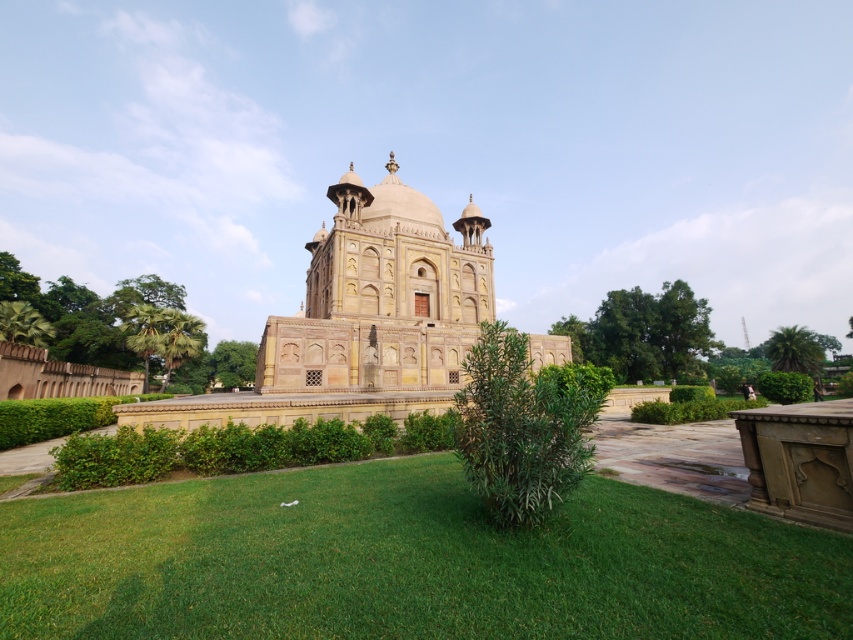
Between green grass at center and green leafy tree at left, which one has less height?

green grass at center

Can you confirm if green grass at center is shorter than green leafy tree at left?

Correct, green grass at center is not as tall as green leafy tree at left.

Who is more forward, (210, 557) or (55, 296)?

Positioned in front is point (210, 557).

Where is `green grass at center`? green grass at center is located at coordinates (408, 563).

Where is `green grass at center`? green grass at center is located at coordinates (408, 563).

Does green grass at center have a greater height compared to green leafy palm tree at lower right?

No, green grass at center is not taller than green leafy palm tree at lower right.

Who is more distant from viewer, [62,561] or [817,372]?

The point [817,372] is more distant.

Find the location of a particular element. This screenshot has width=853, height=640. green grass at center is located at coordinates (408, 563).

Is beige stone palace at center above green leafy tree at left?

Yes, beige stone palace at center is above green leafy tree at left.

Is point (440, 378) positioned behind point (155, 358)?

No, (440, 378) is in front of (155, 358).

At what (x,y) coordinates should I click in order to perform the action: click on beige stone palace at center. Please return your answer as a coordinate pair (x, y). Image resolution: width=853 pixels, height=640 pixels. Looking at the image, I should click on (381, 296).